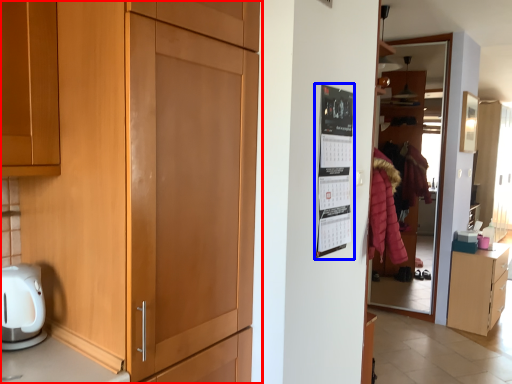
Question: Which object appears closest to the camera in this image, cupboard (highlighted by a red box) or bulletin board (highlighted by a blue box)?

Choices:
 (A) cupboard
 (B) bulletin board

Answer: (A)